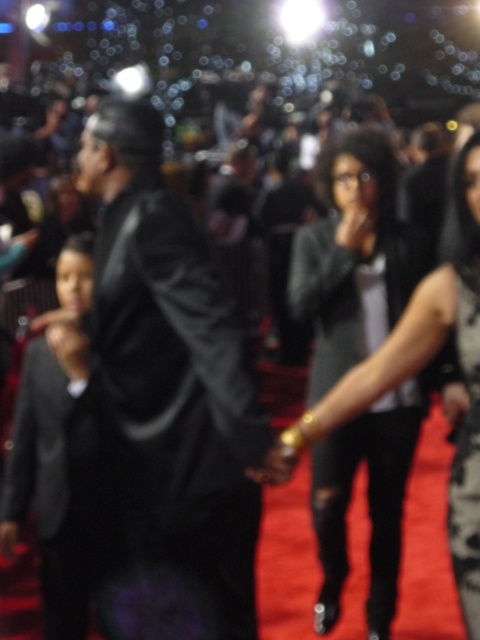
Between leather jacket at center and black satin dress at lower right, which one appears on the left side from the viewer's perspective?

From the viewer's perspective, leather jacket at center appears more on the left side.

Can you confirm if leather jacket at center is positioned above black satin dress at lower right?

Yes, leather jacket at center is above black satin dress at lower right.

Which is in front, point (360, 202) or point (460, 340)?

Point (460, 340) is more forward.

Find the location of a particular element. leather jacket at center is located at coordinates (351, 257).

Can you confirm if black leather suit at center is thinner than black satin dress at lower right?

In fact, black leather suit at center might be wider than black satin dress at lower right.

Is black leather suit at center behind black satin dress at lower right?

That is False.

Between point (214, 428) and point (470, 608), which one is positioned in front?

Point (470, 608)

Where is `black leather suit at center`? The width and height of the screenshot is (480, 640). black leather suit at center is located at coordinates (169, 397).

Does black leather suit at center have a greater width compared to leather jacket at center?

Correct, the width of black leather suit at center exceeds that of leather jacket at center.

Is point (180, 532) farther from viewer compared to point (414, 244)?

That is False.

Identify the location of black leather suit at center. The image size is (480, 640). (169, 397).